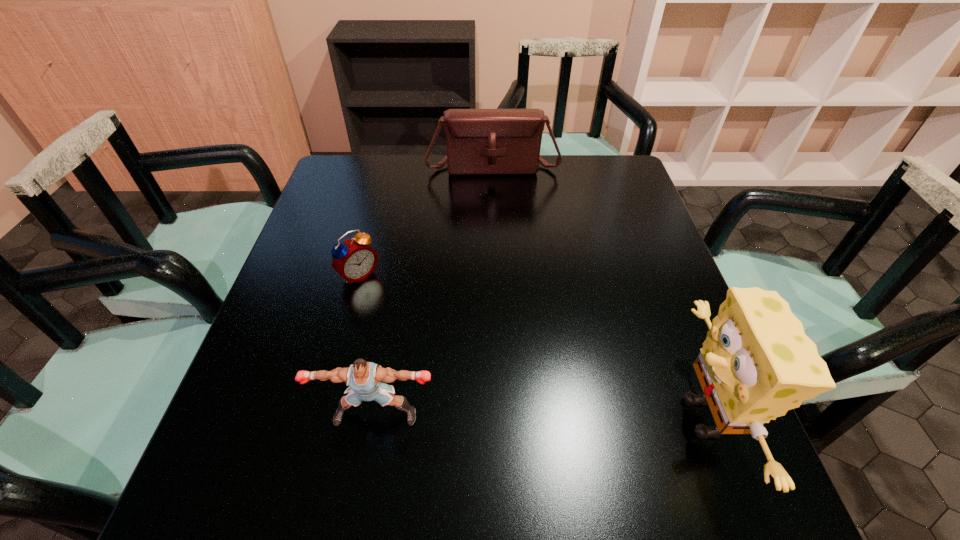
Locate an element on the screen. Image resolution: width=960 pixels, height=540 pixels. object that can be found as the second closest to the farthest object is located at coordinates (756, 363).

Image resolution: width=960 pixels, height=540 pixels. Find the location of `free location that satisfies the following two spatial constraints: 1. on the back side of the shoulder bag; 2. on the left side of the alarm clock`. free location that satisfies the following two spatial constraints: 1. on the back side of the shoulder bag; 2. on the left side of the alarm clock is located at coordinates (389, 166).

Identify the location of free space that satisfies the following two spatial constraints: 1. on the front-facing side of the rightmost object; 2. on the face of the puncher. (375, 417).

Identify the location of vacant space that satisfies the following two spatial constraints: 1. on the front side of the shoulder bag; 2. on the face of the rightmost object. (502, 417).

Where is `vacant space that satisfies the following two spatial constraints: 1. on the front-facing side of the puncher; 2. on the face of the tallest object`? The height and width of the screenshot is (540, 960). vacant space that satisfies the following two spatial constraints: 1. on the front-facing side of the puncher; 2. on the face of the tallest object is located at coordinates (375, 417).

In order to click on free space that satisfies the following two spatial constraints: 1. on the front-facing side of the puncher; 2. on the face of the sponge in this screenshot , I will do `click(375, 417)`.